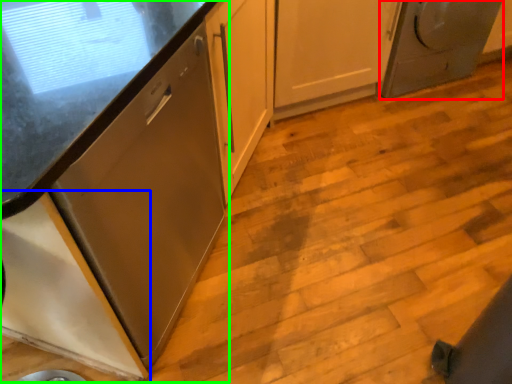
Question: Estimate the real-world distances between objects in this image. Which object is farther from home appliance (highlighted by a red box), cabinetry (highlighted by a blue box) or cabinetry (highlighted by a green box)?

Choices:
 (A) cabinetry
 (B) cabinetry

Answer: (A)